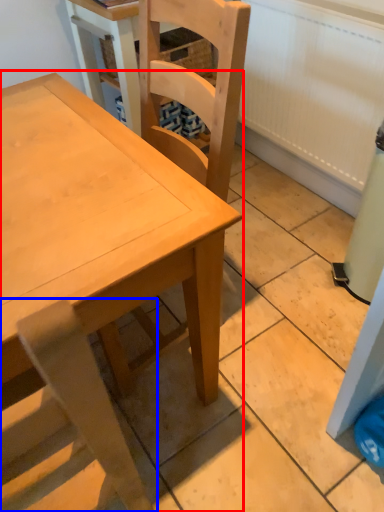
Question: Which point is further to the camera, table (highlighted by a red box) or chair (highlighted by a blue box)?

Choices:
 (A) table
 (B) chair

Answer: (A)